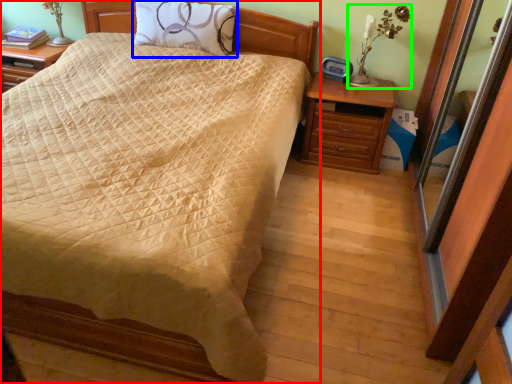
Question: Which object is positioned farthest from bed (highlighted by a red box)? Select from pillow (highlighted by a blue box) and table lamp (highlighted by a green box).

Choices:
 (A) pillow
 (B) table lamp

Answer: (B)